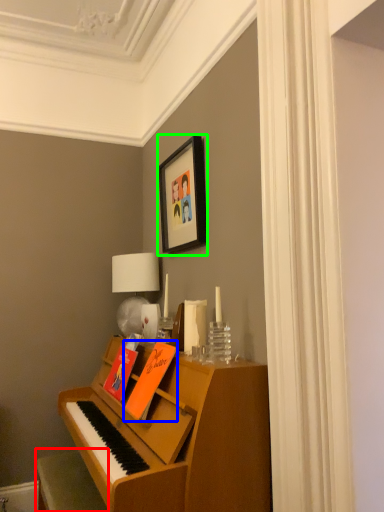
Question: Which object is the farthest from furniture (highlighted by a red box)? Choose among these: book (highlighted by a blue box) or picture frame (highlighted by a green box).

Choices:
 (A) book
 (B) picture frame

Answer: (B)